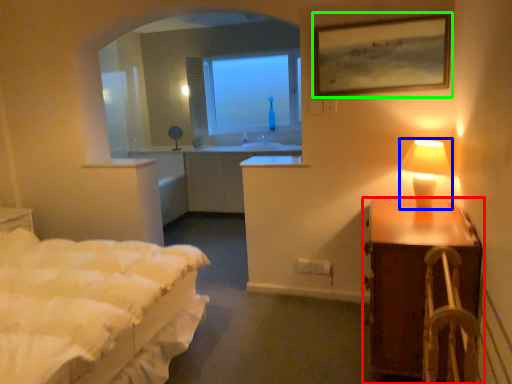
Question: Estimate the real-world distances between objects in this image. Which object is farther from nightstand (highlighted by a red box), table lamp (highlighted by a blue box) or picture frame (highlighted by a green box)?

Choices:
 (A) table lamp
 (B) picture frame

Answer: (B)